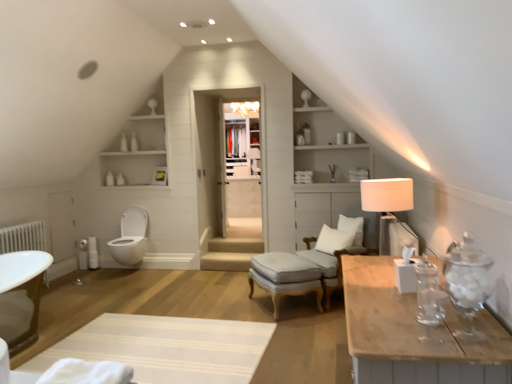
The width and height of the screenshot is (512, 384). Find the location of `vacant region under light gray fabric stool at center (from a real-world perspective)`. vacant region under light gray fabric stool at center (from a real-world perspective) is located at coordinates (292, 305).